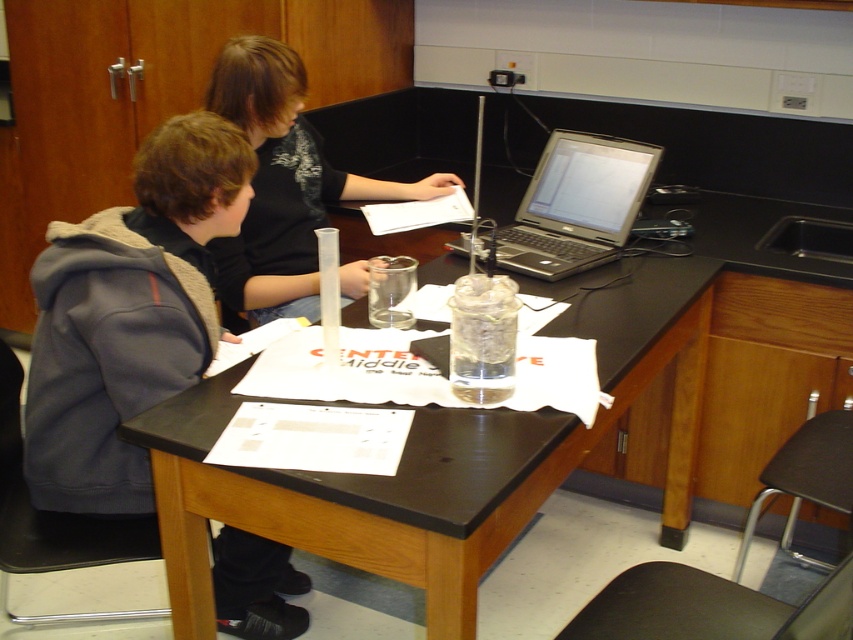
Who is shorter, black matte shirt at center or silver metallic laptop at center?

With less height is silver metallic laptop at center.

Is black matte shirt at center bigger than silver metallic laptop at center?

Indeed, black matte shirt at center has a larger size compared to silver metallic laptop at center.

Looking at this image, measure the distance between point (300, 129) and camera.

Point (300, 129) and camera are 7.27 feet apart from each other.

This screenshot has width=853, height=640. I want to click on black matte shirt at center, so click(283, 182).

Does black matte table at center appear over black matte shirt at center?

Actually, black matte table at center is below black matte shirt at center.

In order to click on black matte table at center in this screenshot , I will do pyautogui.click(x=439, y=458).

Image resolution: width=853 pixels, height=640 pixels. What are the coordinates of `black matte table at center` in the screenshot? It's located at (439, 458).

Looking at this image, between gray fleece hoodie at left and black plastic stool at lower right, which one has more height?

With more height is gray fleece hoodie at left.

Locate an element on the screen. This screenshot has height=640, width=853. gray fleece hoodie at left is located at coordinates (129, 314).

In order to click on gray fleece hoodie at left in this screenshot , I will do `click(129, 314)`.